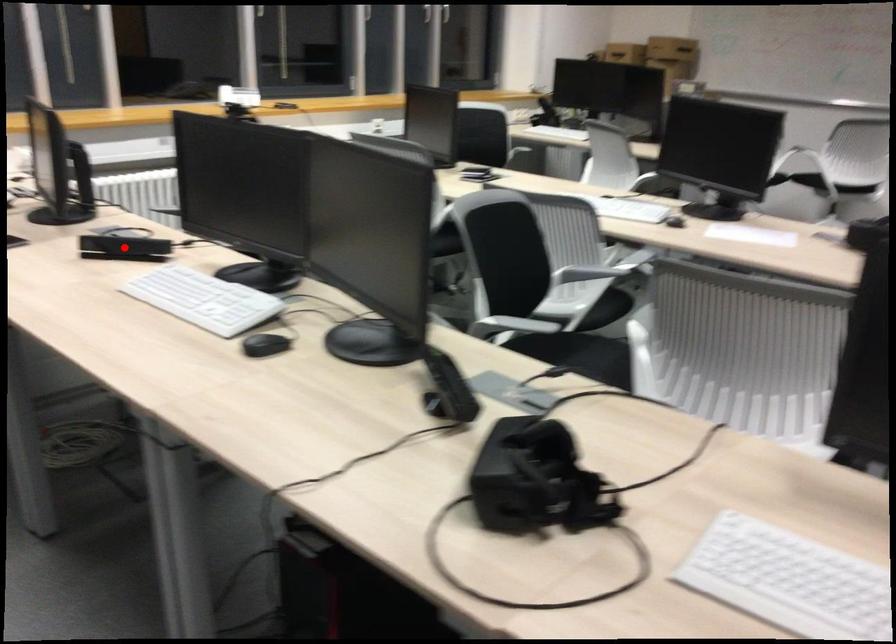
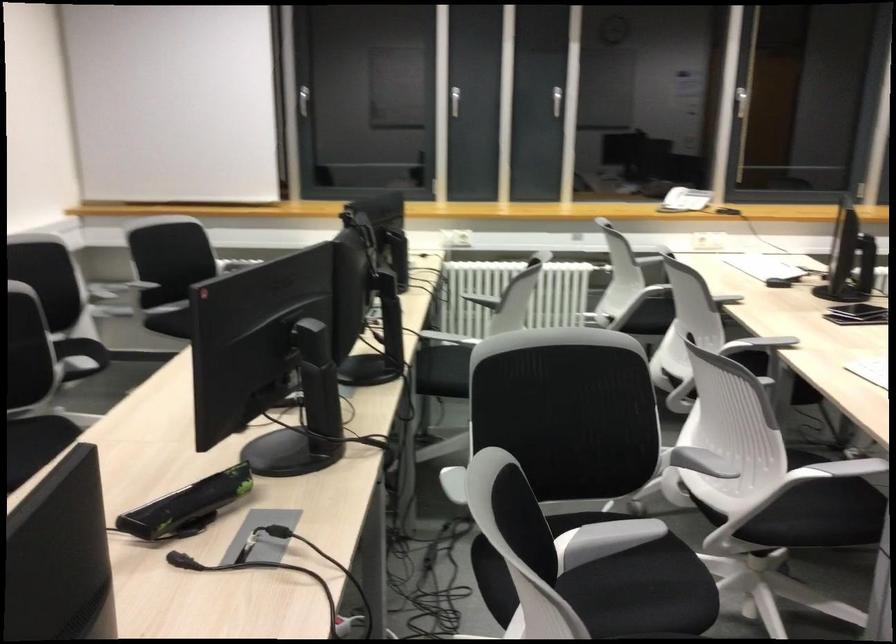
Question: I am providing you with two images of the same scene from different viewpoints. A red point is marked on the first image. Can you still see the location of the red point in image 2?

Choices:
 (A) Yes
 (B) No

Answer: (B)